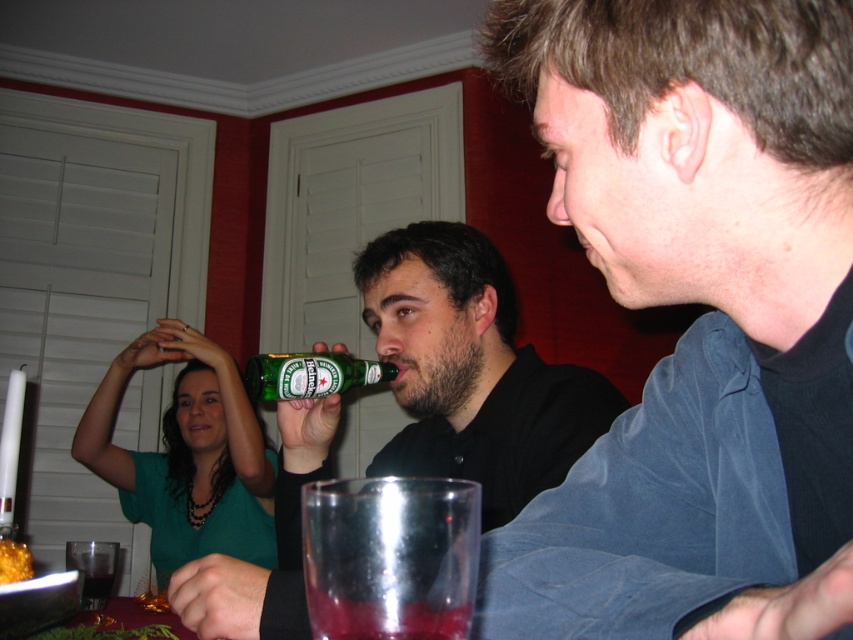
You are at the party and want to grab the green glass bottle at center. Where should you look to find it?

The green glass bottle at center is located at point coordinates 0.586 on the x axis and 0.365 on the y axis.

You are standing in the dining room and want to hand a gift to the person wearing the green matte shirt at upper left. Based on their position at coordinates point0.711,0.220, can you estimate whether they are seated to the left or right side of the room?

The green matte shirt at upper left is located at point0.[187,639], which indicates that the person is positioned on the right side of the room relative to the observer.

You are standing in the room and want to take a photo of both point [4,563] and point [85,576]. Which point should you focus on first to ensure both are in clear view?

You should focus on point [4,563] first because it is closer to the camera than point [85,576]. By focusing on the closer point, the farther point will also be in focus if within the depth of field.